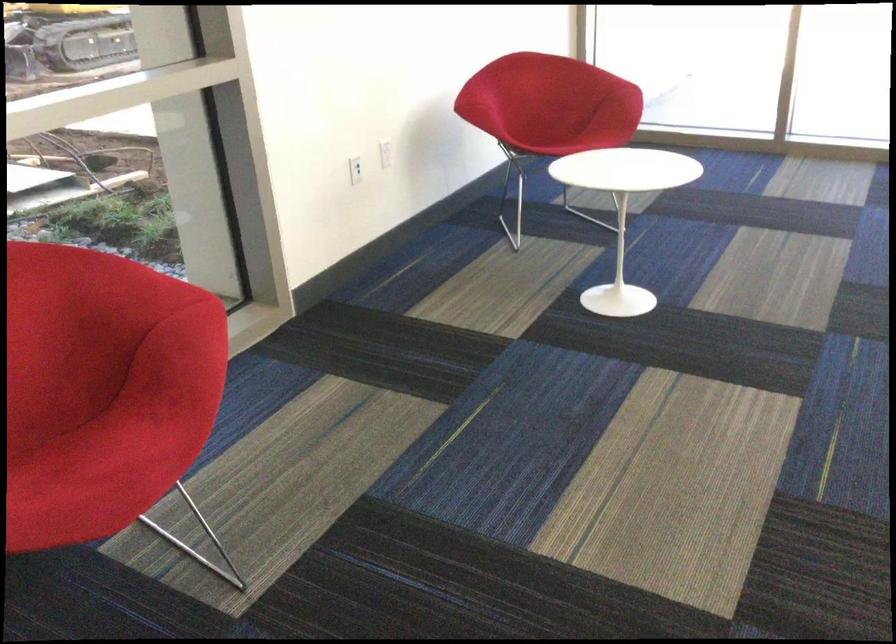
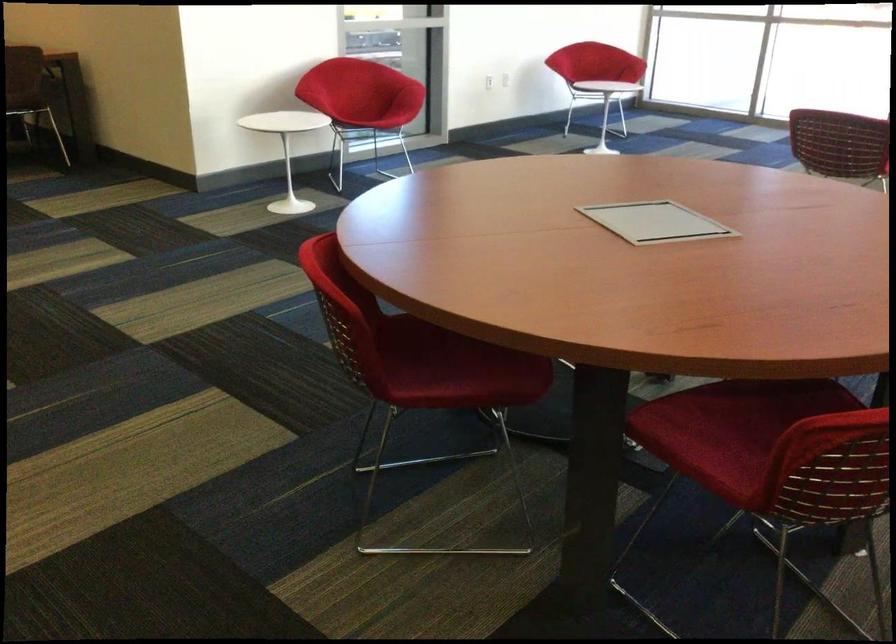
Question: I am providing you with two images of the same scene from different viewpoints. Which of the following objects are not visible in image2?

Choices:
 (A) red chair sitting surface
 (B) red chair armrest
 (C) yellow lid spice jar
 (D) white power outlet

Answer: (D)